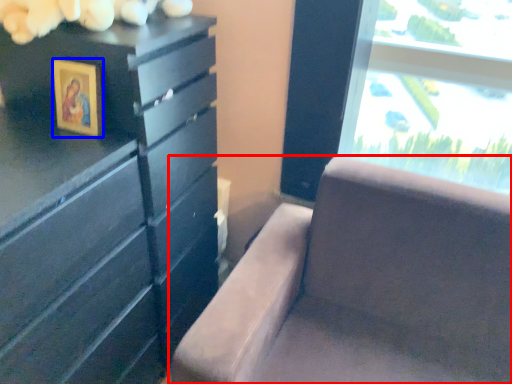
Question: Among these objects, which one is farthest to the camera, furniture (highlighted by a red box) or picture frame (highlighted by a blue box)?

Choices:
 (A) furniture
 (B) picture frame

Answer: (B)